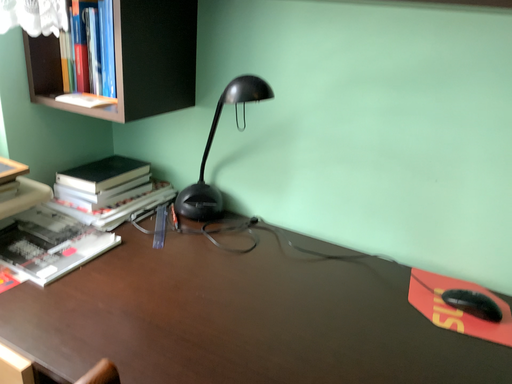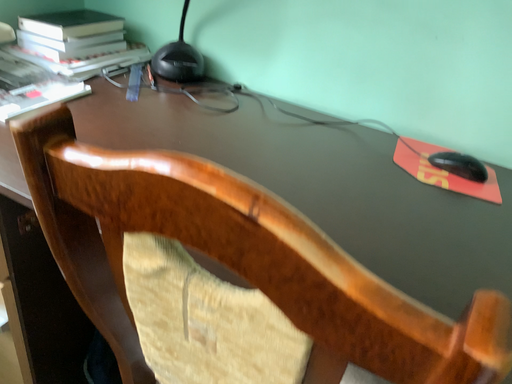
Question: How did the camera likely rotate when shooting the video?

Choices:
 (A) rotated downward
 (B) rotated upward

Answer: (A)